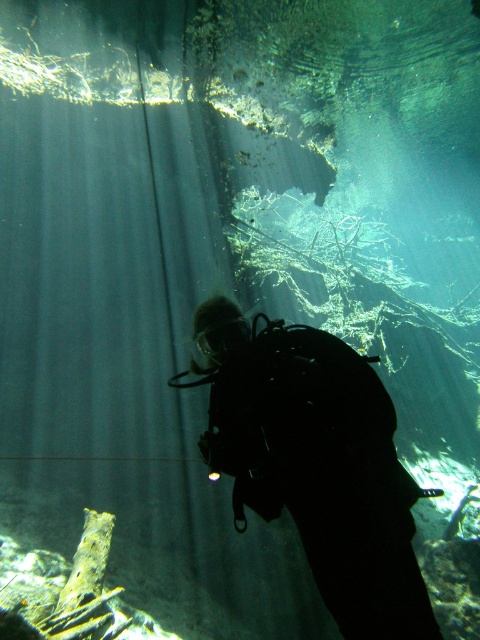
You are the scuba diver in the image. You notice two points in the water, one at point [303,352] and another at point [469,497]. Which point is nearer to you?

The point at [303,352] is closer to you than the point at [469,497].

You are a marine biologist observing the underwater scene. You notice the black matte scuba diver at center and the shiny silver fish at lower right. Which object appears larger in the image?

The black matte scuba diver at center appears larger than the shiny silver fish at lower right.